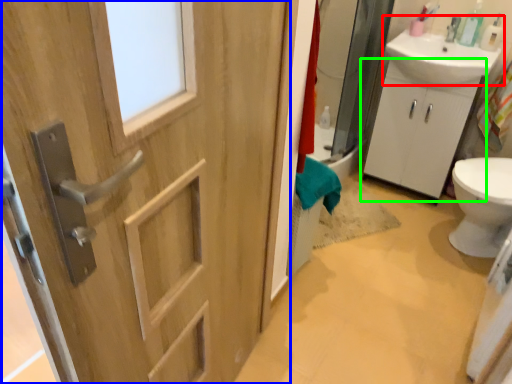
Question: Which is nearer to the sink (highlighted by a red box)? door (highlighted by a blue box) or bathroom cabinet (highlighted by a green box).

Choices:
 (A) door
 (B) bathroom cabinet

Answer: (B)